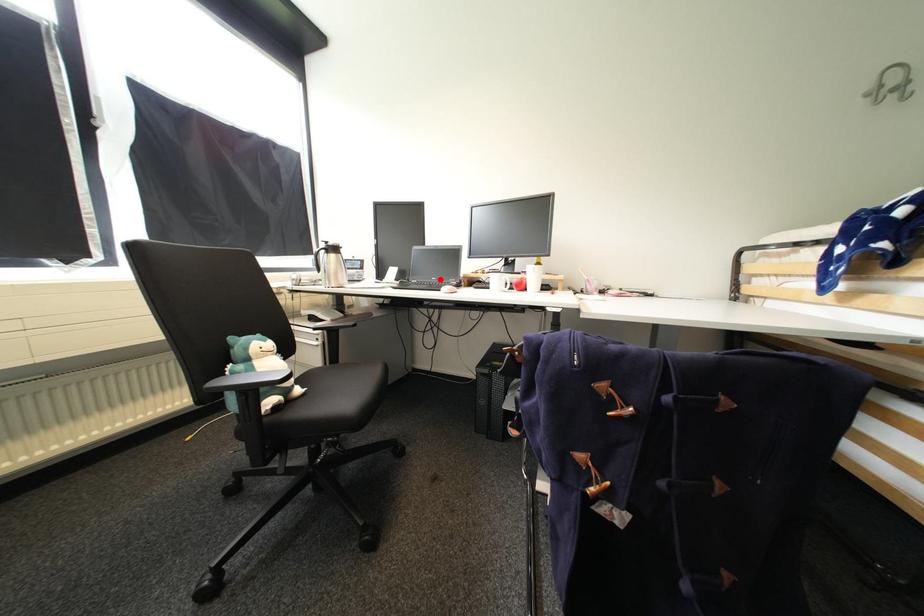
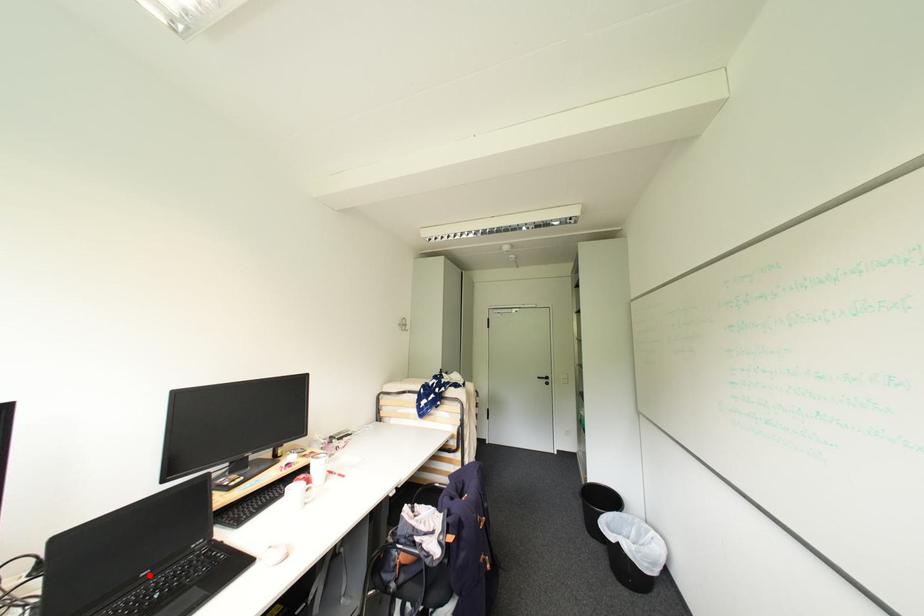
I am providing you with two images of the same scene from different viewpoints. A red point is marked on the first image and another point is marked on the second image. Is the red point in image1 aligned with the point shown in image2?

Yes